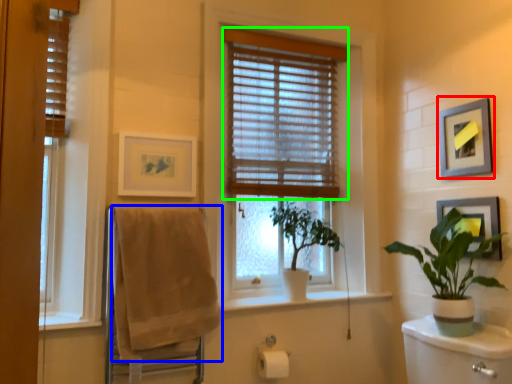
Question: Estimate the real-world distances between objects in this image. Which object is farther from picture frame (highlighted by a red box), bath towel (highlighted by a blue box) or window blind (highlighted by a green box)?

Choices:
 (A) bath towel
 (B) window blind

Answer: (A)